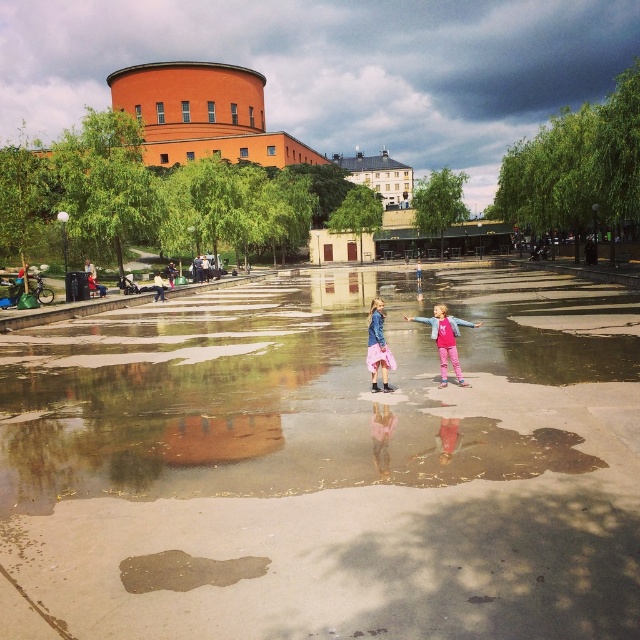
You are a photographer trying to capture the reflections of the two girls in the puddle. Since the shiny concrete puddle at center and the pink fabric dress at center are both in your viewfinder, which one is positioned closer to you?

The shiny concrete puddle at center is closer to the viewer than the pink fabric dress at center, so the puddle will be closer to you.

You are a photographer trying to capture the reflections of the two girls in the puddle. Which of the two items, the pink fabric dress at center or the pink satin skirt at center, would appear narrower in the reflection?

The pink fabric dress at center would appear narrower in the reflection because it is thinner than the pink satin skirt at center.